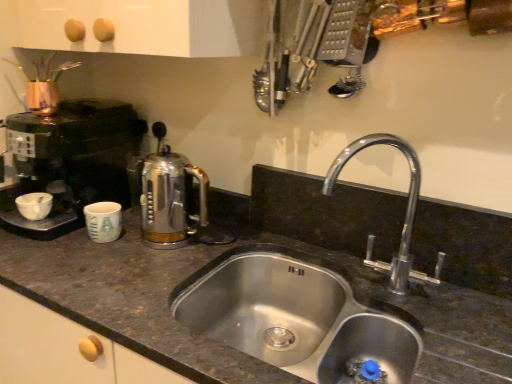
Question: Does satin chrome coffee pot at center lie behind white glossy bowl at left?

Choices:
 (A) yes
 (B) no

Answer: (B)

Question: Considering the relative sizes of satin chrome coffee pot at center and white glossy bowl at left in the image provided, is satin chrome coffee pot at center smaller than white glossy bowl at left?

Choices:
 (A) no
 (B) yes

Answer: (A)

Question: Can you confirm if satin chrome coffee pot at center is thinner than white glossy bowl at left?

Choices:
 (A) yes
 (B) no

Answer: (B)

Question: Considering the relative sizes of satin chrome coffee pot at center and white glossy bowl at left in the image provided, is satin chrome coffee pot at center wider than white glossy bowl at left?

Choices:
 (A) yes
 (B) no

Answer: (A)

Question: Is satin chrome coffee pot at center facing towards white glossy bowl at left?

Choices:
 (A) yes
 (B) no

Answer: (B)

Question: Is chrome metallic faucet at center right wider or thinner than matte ceramic mug at left?

Choices:
 (A) thin
 (B) wide

Answer: (B)

Question: Considering the positions of chrome metallic faucet at center right and matte ceramic mug at left in the image, is chrome metallic faucet at center right bigger or smaller than matte ceramic mug at left?

Choices:
 (A) small
 (B) big

Answer: (B)

Question: From the image's perspective, relative to matte ceramic mug at left, is chrome metallic faucet at center right above or below?

Choices:
 (A) above
 (B) below

Answer: (A)

Question: Choose the correct answer: Is chrome metallic faucet at center right inside matte ceramic mug at left or outside it?

Choices:
 (A) outside
 (B) inside

Answer: (A)

Question: From the image's perspective, is matte ceramic mug at left positioned above or below stainless steel sink at center?

Choices:
 (A) below
 (B) above

Answer: (B)

Question: Considering the positions of matte ceramic mug at left and stainless steel sink at center in the image, is matte ceramic mug at left wider or thinner than stainless steel sink at center?

Choices:
 (A) thin
 (B) wide

Answer: (A)

Question: From their relative heights in the image, would you say matte ceramic mug at left is taller or shorter than stainless steel sink at center?

Choices:
 (A) tall
 (B) short

Answer: (B)

Question: Considering the relative positions of matte ceramic mug at left and stainless steel sink at center in the image provided, is matte ceramic mug at left to the left or to the right of stainless steel sink at center?

Choices:
 (A) left
 (B) right

Answer: (A)

Question: Is point (205, 294) closer or farther from the camera than point (184, 231)?

Choices:
 (A) closer
 (B) farther

Answer: (A)

Question: Choose the correct answer: Is stainless steel sink at center inside satin chrome coffee pot at center or outside it?

Choices:
 (A) inside
 (B) outside

Answer: (B)